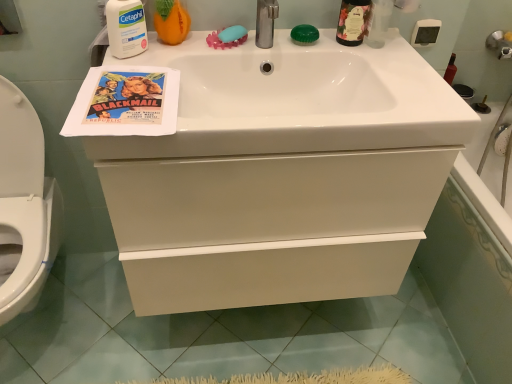
The width and height of the screenshot is (512, 384). In order to click on vacant area to the left of blue rubber soap at upper center, the 1th soap viewed from the left in this screenshot , I will do `click(170, 40)`.